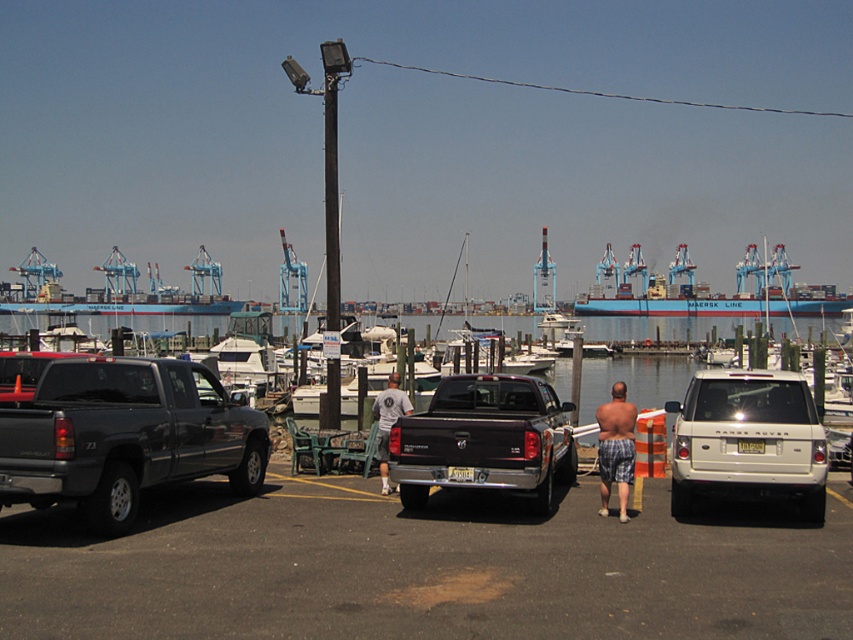
You are standing at the edge of the marina and want to determine which of the two points, point 1 at coordinates point (471, 448) or point 2 at coordinates point (392, 400), is closer to you. Based on the scene description, which point is nearer?

Point 1 at coordinates point (471, 448) is closer to the viewer than point 2 at coordinates point (392, 400).

You are standing at the edge of the dock and want to compare the sizes of the blue matte container ship at center and the white cotton shirt at center. Which one is wider?

The blue matte container ship at center is wider than the white cotton shirt at center.